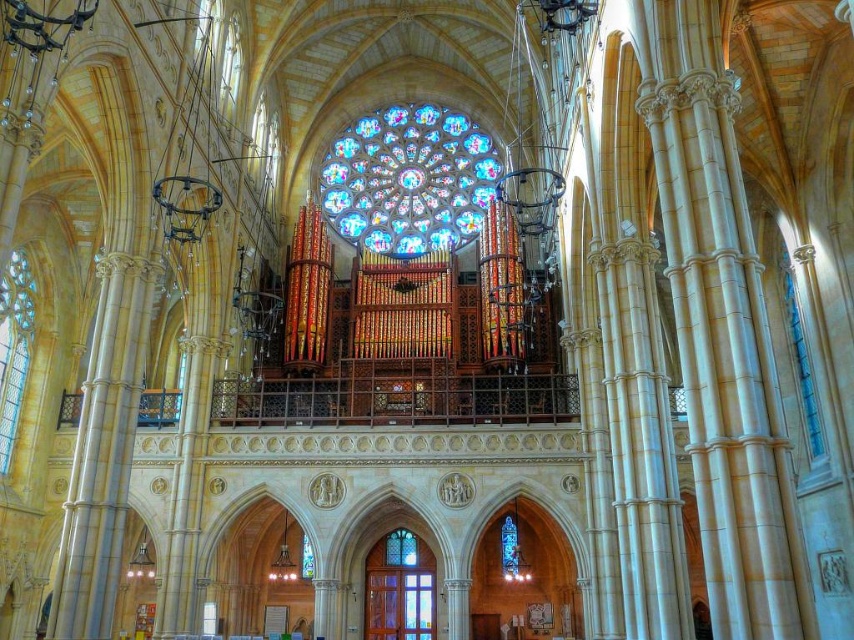
Question: Which object is closer to the camera taking this photo?

Choices:
 (A) clear stained glass at left
 (B) translucent wooden door at lower center

Answer: (A)

Question: Does stained glass at center have a smaller size compared to translucent wooden door at lower center?

Choices:
 (A) no
 (B) yes

Answer: (A)

Question: Is stained glass at center above translucent wooden door at lower center?

Choices:
 (A) yes
 (B) no

Answer: (A)

Question: Which of the following is the farthest from the observer?

Choices:
 (A) stained glass at center
 (B) translucent wooden door at lower center

Answer: (A)

Question: Can you confirm if stained glass at center is positioned to the left of translucent wooden door at lower center?

Choices:
 (A) yes
 (B) no

Answer: (A)

Question: Which object appears farthest from the camera in this image?

Choices:
 (A) translucent wooden door at lower center
 (B) clear stained glass at left
 (C) stained glass at center

Answer: (C)